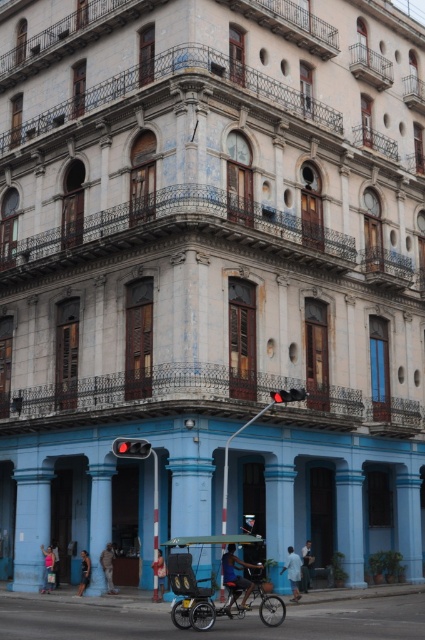
Question: Considering the real-world distances, which object is farthest from the brown leather jacket at lower center?

Choices:
 (A) red plastic traffic light at center
 (B) light blue fabric at lower center
 (C) dark blue jeans at lower left
 (D) light blue shorts at lower center

Answer: (A)

Question: Is light blue fabric at lower center thinner than brown leather jacket at lower center?

Choices:
 (A) yes
 (B) no

Answer: (B)

Question: Which point is closer to the camera?

Choices:
 (A) (42, 577)
 (B) (257, 564)
 (C) (121, 444)

Answer: (C)

Question: Is brown leather jacket at lower center closer to the viewer compared to light blue shorts at lower center?

Choices:
 (A) no
 (B) yes

Answer: (B)

Question: Among these objects, which one is farthest from the camera?

Choices:
 (A) red glass traffic light at lower left
 (B) dark blue jeans at lower left
 (C) pink fabric bag at lower center

Answer: (C)

Question: Is brown leather jacket at lower center positioned behind dark blue jeans at lower left?

Choices:
 (A) no
 (B) yes

Answer: (A)